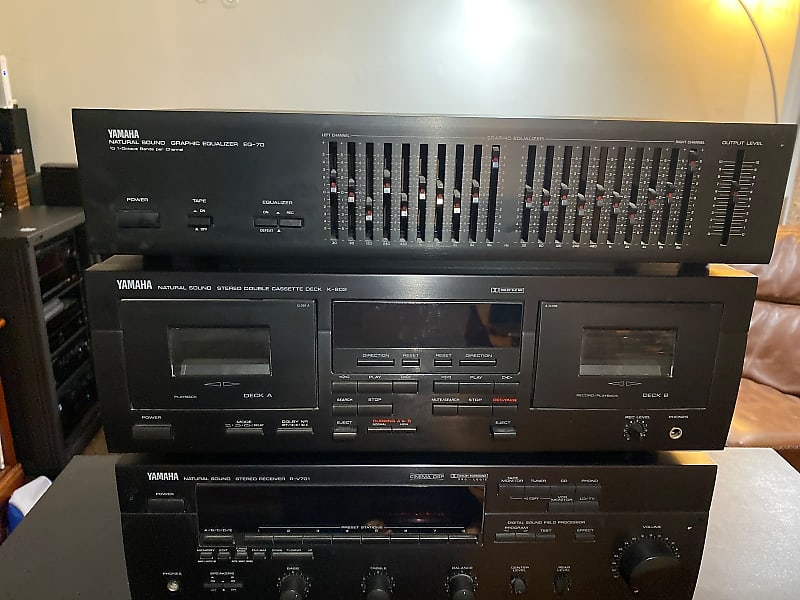
Find the location of a particular element. The height and width of the screenshot is (600, 800). couch is located at coordinates (794, 363).